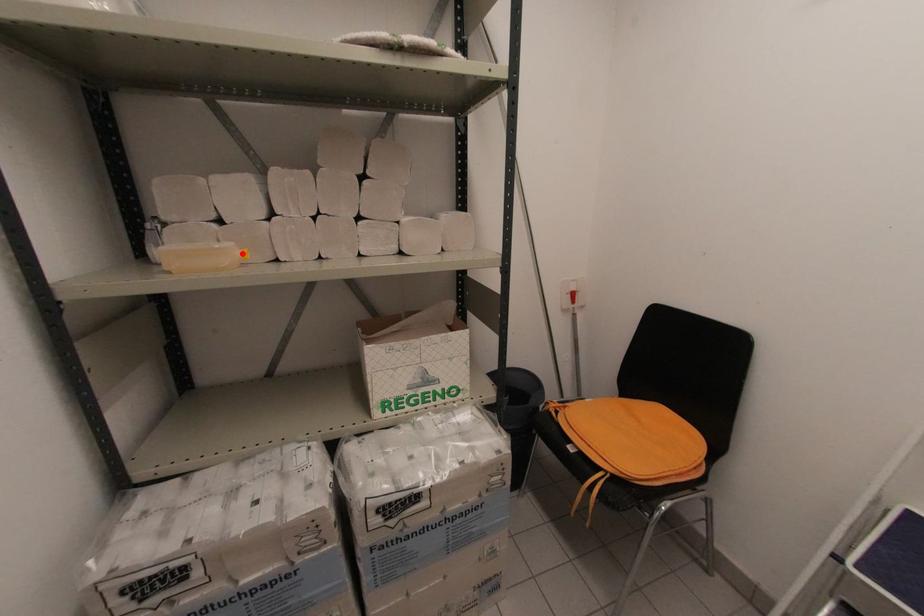
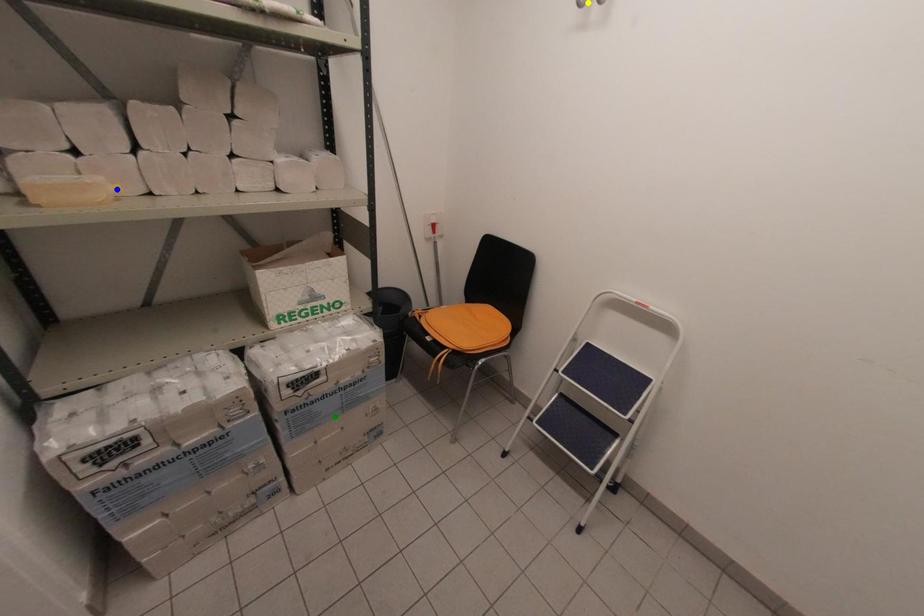
Question: I am providing you with two images of the same scene from different viewpoints. A red point is marked on the first image. You are given multiple points on the second image. In image 2, which mark is for the same physical point as the one in image 1?

Choices:
 (A) yellow point
 (B) green point
 (C) blue point

Answer: (C)